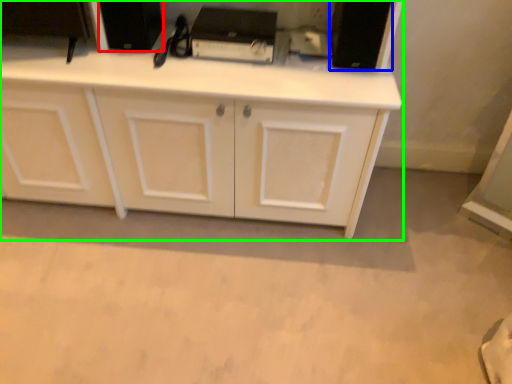
Question: Which is farther away from appliance (highlighted by a red box)? appliance (highlighted by a blue box) or cabinetry (highlighted by a green box)?

Choices:
 (A) appliance
 (B) cabinetry

Answer: (A)